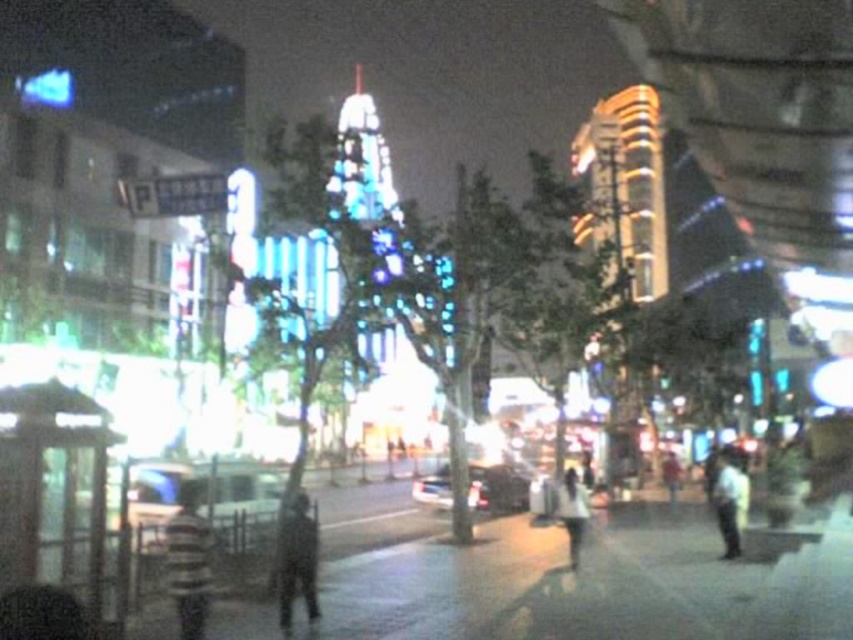
Is dark textured coat at center to the right of white matte shirt at center from the viewer's perspective?

Incorrect, dark textured coat at center is not on the right side of white matte shirt at center.

Is dark textured coat at center below white matte shirt at center?

Incorrect, dark textured coat at center is not positioned below white matte shirt at center.

Locate an element on the screen. This screenshot has width=853, height=640. dark textured coat at center is located at coordinates (297, 561).

Identify the location of dark textured coat at center. This screenshot has height=640, width=853. (297, 561).

Is striped fabric shirt at center wider than white matte shirt at right?

No, striped fabric shirt at center is not wider than white matte shirt at right.

Is striped fabric shirt at center thinner than white matte shirt at right?

Yes.

Does point (192, 492) come in front of point (740, 525)?

Yes.

At what (x,y) coordinates should I click in order to perform the action: click on striped fabric shirt at center. Please return your answer as a coordinate pair (x, y). The width and height of the screenshot is (853, 640). Looking at the image, I should click on (189, 561).

Who is taller, striped fabric shirt at center or dark textured coat at center?

striped fabric shirt at center

Can you confirm if striped fabric shirt at center is smaller than dark textured coat at center?

Actually, striped fabric shirt at center might be larger than dark textured coat at center.

Which is in front, point (189, 611) or point (282, 564)?

Point (189, 611)

In order to click on striped fabric shirt at center in this screenshot , I will do `click(189, 561)`.